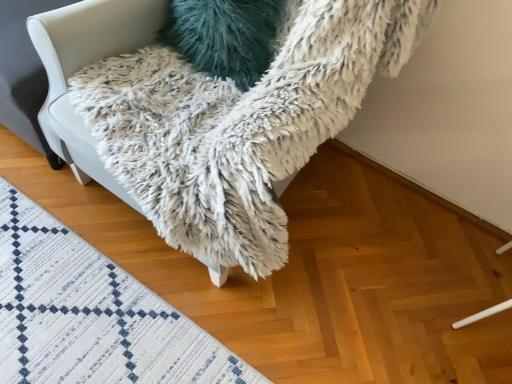
Question: Is white woven mat at lower left behind white fluffy blanket at upper center?

Choices:
 (A) no
 (B) yes

Answer: (B)

Question: Can you confirm if white woven mat at lower left is shorter than white fluffy blanket at upper center?

Choices:
 (A) no
 (B) yes

Answer: (B)

Question: From the image's perspective, is white woven mat at lower left below white fluffy blanket at upper center?

Choices:
 (A) no
 (B) yes

Answer: (B)

Question: Considering the relative sizes of white woven mat at lower left and white fluffy blanket at upper center in the image provided, is white woven mat at lower left wider than white fluffy blanket at upper center?

Choices:
 (A) yes
 (B) no

Answer: (B)

Question: Is white woven mat at lower left bigger than white fluffy blanket at upper center?

Choices:
 (A) yes
 (B) no

Answer: (B)

Question: From a real-world perspective, does white woven mat at lower left stand above white fluffy blanket at upper center?

Choices:
 (A) yes
 (B) no

Answer: (B)

Question: From a real-world perspective, is white fluffy blanket at upper center under teal fuzzy pillow at upper center?

Choices:
 (A) no
 (B) yes

Answer: (A)

Question: Is white fluffy blanket at upper center to the right of teal fuzzy pillow at upper center from the viewer's perspective?

Choices:
 (A) yes
 (B) no

Answer: (A)

Question: Is teal fuzzy pillow at upper center surrounded by white fluffy blanket at upper center?

Choices:
 (A) no
 (B) yes

Answer: (B)

Question: Is white fluffy blanket at upper center positioned far away from teal fuzzy pillow at upper center?

Choices:
 (A) no
 (B) yes

Answer: (A)

Question: Are white fluffy blanket at upper center and teal fuzzy pillow at upper center making contact?

Choices:
 (A) yes
 (B) no

Answer: (B)

Question: From the image's perspective, is white fluffy blanket at upper center beneath teal fuzzy pillow at upper center?

Choices:
 (A) yes
 (B) no

Answer: (A)

Question: Is teal fuzzy pillow at upper center at the back of white woven mat at lower left?

Choices:
 (A) no
 (B) yes

Answer: (A)